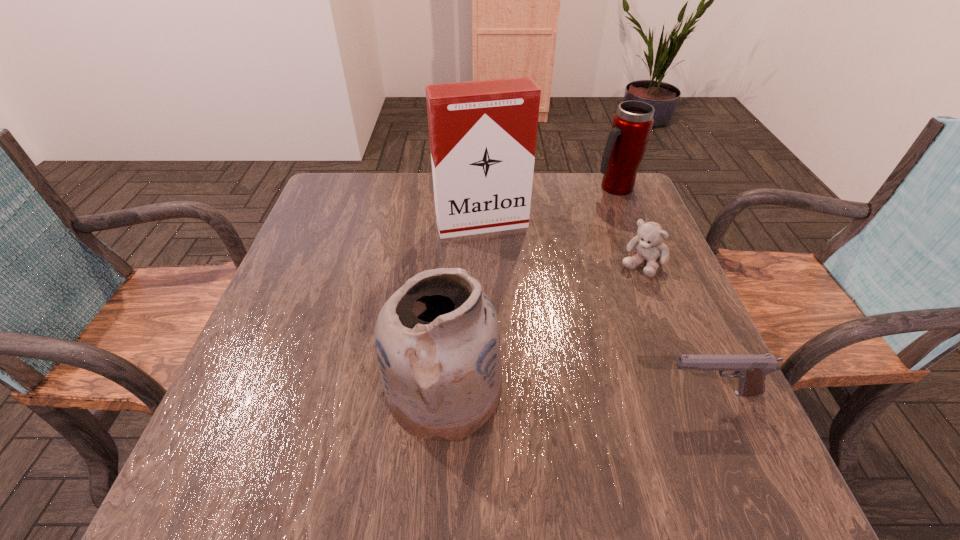
Identify the location of pottery. Image resolution: width=960 pixels, height=540 pixels. (437, 340).

You are a GUI agent. You are given a task and a screenshot of the screen. Output one action in this format:
    pyautogui.click(x=<x>, y=<y>)
    Task: Click on the pistol
    The width and height of the screenshot is (960, 540).
    Given the screenshot: What is the action you would take?
    pyautogui.click(x=751, y=370)

Where is `teddy bear`? teddy bear is located at coordinates (649, 245).

I want to click on thermos bottle, so click(x=632, y=124).

Find the location of `the third shortest object`. the third shortest object is located at coordinates (632, 124).

Locate an element on the screen. cigarette_case is located at coordinates (483, 134).

The height and width of the screenshot is (540, 960). Identify the location of the tallest object. (483, 134).

Locate an element on the screen. This screenshot has height=540, width=960. free space located on the back of the pottery is located at coordinates pyautogui.click(x=453, y=262).

Where is `free space located at the barrel of the pistol`? This screenshot has width=960, height=540. free space located at the barrel of the pistol is located at coordinates (483, 393).

Find the location of a particular element. This screenshot has width=960, height=540. free space located 0.140m at the barrel of the pistol is located at coordinates (587, 393).